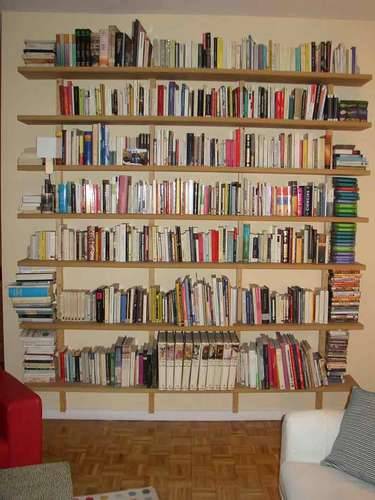
Where is `red sofa`? The width and height of the screenshot is (375, 500). red sofa is located at coordinates (28, 430).